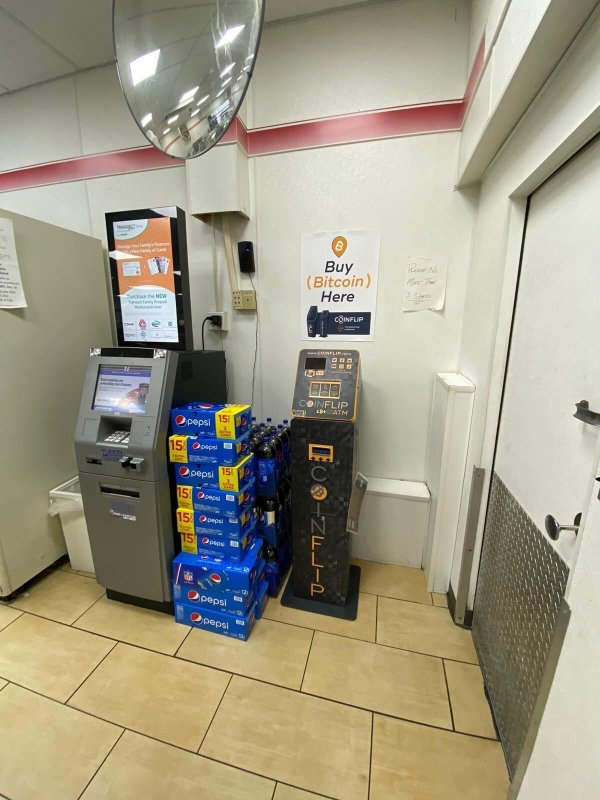
The width and height of the screenshot is (600, 800). In order to click on door handle in this screenshot , I will do `click(550, 525)`.